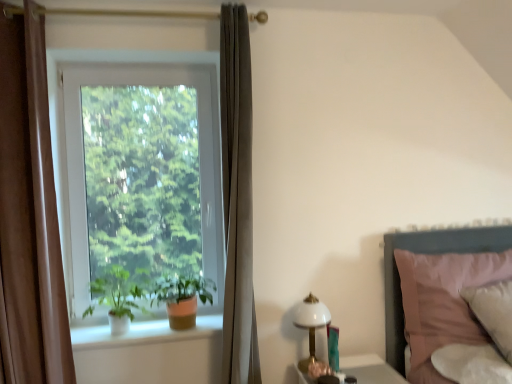
Question: Does white glass lampshade at right have a smaller size compared to pink fabric bed at right?

Choices:
 (A) no
 (B) yes

Answer: (B)

Question: Is white glass lampshade at right in contact with pink fabric bed at right?

Choices:
 (A) yes
 (B) no

Answer: (B)

Question: Is white glass lampshade at right outside of pink fabric bed at right?

Choices:
 (A) no
 (B) yes

Answer: (B)

Question: Is white glass lampshade at right not close to pink fabric bed at right?

Choices:
 (A) yes
 (B) no

Answer: (B)

Question: Does white glass lampshade at right have a lesser height compared to pink fabric bed at right?

Choices:
 (A) no
 (B) yes

Answer: (B)

Question: Considering the positions of white ceramic window sill at lower left and brown velvet curtain at left in the image, is white ceramic window sill at lower left wider or thinner than brown velvet curtain at left?

Choices:
 (A) thin
 (B) wide

Answer: (B)

Question: In terms of height, does white ceramic window sill at lower left look taller or shorter compared to brown velvet curtain at left?

Choices:
 (A) tall
 (B) short

Answer: (B)

Question: From the image's perspective, is white ceramic window sill at lower left above or below brown velvet curtain at left?

Choices:
 (A) above
 (B) below

Answer: (B)

Question: Is white ceramic window sill at lower left inside the boundaries of brown velvet curtain at left, or outside?

Choices:
 (A) outside
 (B) inside

Answer: (A)

Question: Is point (142, 322) closer or farther from the camera than point (364, 369)?

Choices:
 (A) farther
 (B) closer

Answer: (A)

Question: From their relative heights in the image, would you say white ceramic window sill at lower left is taller or shorter than white glossy table at lower right?

Choices:
 (A) short
 (B) tall

Answer: (B)

Question: Is white ceramic window sill at lower left wider or thinner than white glossy table at lower right?

Choices:
 (A) wide
 (B) thin

Answer: (B)

Question: Would you say white ceramic window sill at lower left is to the left or to the right of white glossy table at lower right in the picture?

Choices:
 (A) right
 (B) left

Answer: (B)

Question: Relative to white matte plant at window, which is the second houseplant in right-to-left order, is pink fabric bed at right in front or behind?

Choices:
 (A) front
 (B) behind

Answer: (A)

Question: Visually, is pink fabric bed at right positioned to the left or to the right of white matte plant at window, the first houseplant when ordered from left to right?

Choices:
 (A) left
 (B) right

Answer: (B)